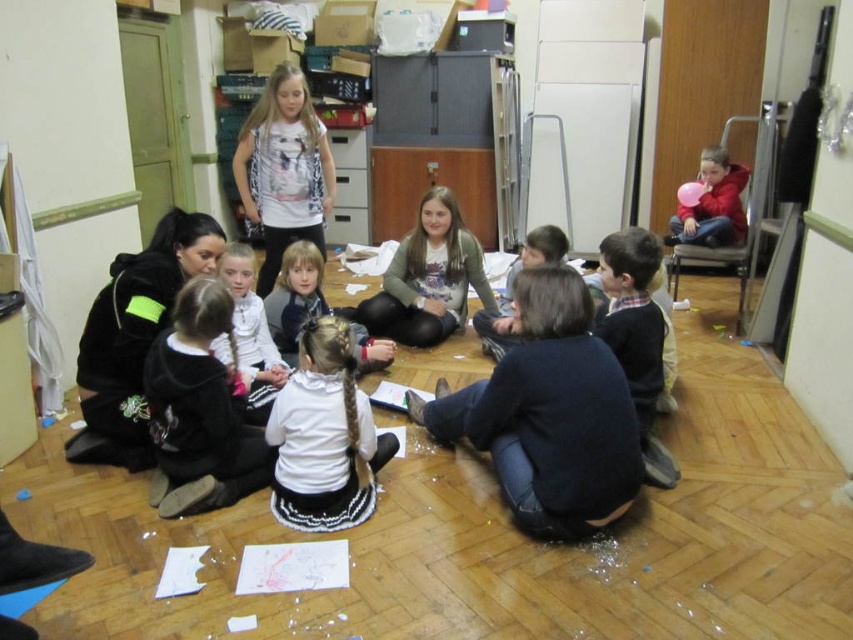
You are standing in the room and want to move from the point at coordinates point (119, 435) to the point at coordinates point (283, 243). Since you need to step over some scattered papers and confetti, will you have to move forward or backward to reach your destination?

Since point (119, 435) is in front of point (283, 243), you will need to move backward to reach the point at (283, 243) from your current position.

You are a photographer standing in the center of the room. You want to take a photo of the children seated on the floor in the center. However, there is a black velvet jacket at lower left blocking your view. Can you move the jacket to the right side of the room to clear the view?

The black velvet jacket at lower left is at point (134, 337). Moving it to the right side of the room would clear the view of the children in the center.

You are standing in the room and want to walk to both points. Which point, point (532, 314) or point (311, 262), will you reach first?

Point (532, 314) is closer to the viewer than point (311, 262), so you will reach point (532, 314) first.